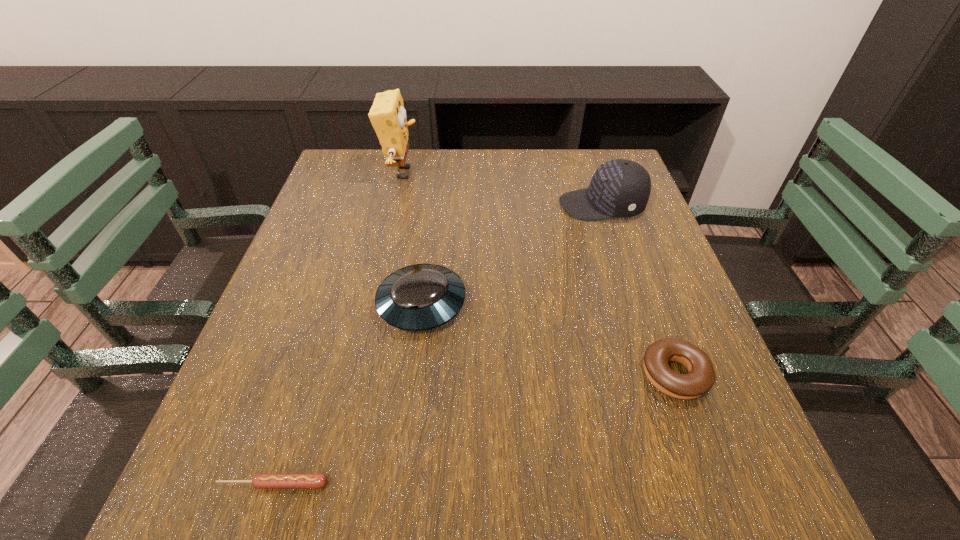
At what (x,y) coordinates should I click in order to perform the action: click on free space between the nearest object and the third farthest object. Please return your answer as a coordinate pair (x, y). This screenshot has height=540, width=960. Looking at the image, I should click on (348, 394).

Locate which object ranks third in proximity to the fourth farthest object. Please provide its 2D coordinates. Your answer should be formatted as a tuple, i.e. [(x, y)], where the tuple contains the x and y coordinates of a point satisfying the conditions above.

[(260, 481)]

Point out which object is positioned as the fourth nearest to the sponge. Please provide its 2D coordinates. Your answer should be formatted as a tuple, i.e. [(x, y)], where the tuple contains the x and y coordinates of a point satisfying the conditions above.

[(260, 481)]

Identify the location of vacant space that satisfies the following two spatial constraints: 1. at the front of the baseball cap where the brim is located; 2. on the front side of the shortest object. (693, 484).

You are a GUI agent. You are given a task and a screenshot of the screen. Output one action in this format:
    pyautogui.click(x=<x>, y=<y>)
    Task: Click on the vacant area that satisfies the following two spatial constraints: 1. on the front side of the saucer; 2. on the left side of the fourth tallest object
    The image size is (960, 540).
    Given the screenshot: What is the action you would take?
    pyautogui.click(x=413, y=375)

Image resolution: width=960 pixels, height=540 pixels. What are the coordinates of `vacant space that satisfies the following two spatial constraints: 1. at the front of the second tallest object where the brim is located; 2. on the left side of the second nearest object` in the screenshot? It's located at (657, 375).

This screenshot has height=540, width=960. In order to click on vacant area in the image that satisfies the following two spatial constraints: 1. at the front of the second shortest object where the brim is located; 2. on the right side of the second tallest object in this screenshot , I will do `click(657, 375)`.

The image size is (960, 540). Identify the location of free space that satisfies the following two spatial constraints: 1. at the front of the baseball cap where the brim is located; 2. on the back side of the fourth farthest object. pyautogui.click(x=657, y=375).

Where is `vacant space that satisfies the following two spatial constraints: 1. at the front of the baseball cap where the brim is located; 2. on the left side of the doughnut`? vacant space that satisfies the following two spatial constraints: 1. at the front of the baseball cap where the brim is located; 2. on the left side of the doughnut is located at coordinates (657, 375).

Image resolution: width=960 pixels, height=540 pixels. In order to click on vacant region that satisfies the following two spatial constraints: 1. at the front of the fourth farthest object where the brim is located; 2. on the right side of the baseball cap in this screenshot , I will do `click(657, 375)`.